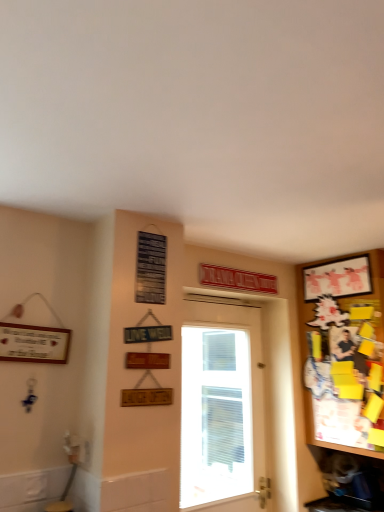
Question: Is white glossy door at center positioned beyond the bounds of matte white picture frame at upper right?

Choices:
 (A) yes
 (B) no

Answer: (A)

Question: Is white glossy door at center turned away from matte white picture frame at upper right?

Choices:
 (A) yes
 (B) no

Answer: (B)

Question: Could you tell me if white glossy door at center is turned towards matte white picture frame at upper right?

Choices:
 (A) no
 (B) yes

Answer: (B)

Question: From the image's perspective, is white glossy door at center over matte white picture frame at upper right?

Choices:
 (A) no
 (B) yes

Answer: (A)

Question: Is white glossy door at center positioned far away from matte white picture frame at upper right?

Choices:
 (A) no
 (B) yes

Answer: (B)

Question: Considering the relative positions of wooden bulletin board at right and white glossy door at center in the image provided, is wooden bulletin board at right to the left or to the right of white glossy door at center?

Choices:
 (A) right
 (B) left

Answer: (A)

Question: Is wooden bulletin board at right taller or shorter than white glossy door at center?

Choices:
 (A) tall
 (B) short

Answer: (B)

Question: From a real-world perspective, is wooden bulletin board at right physically located above or below white glossy door at center?

Choices:
 (A) below
 (B) above

Answer: (B)

Question: Considering their positions, is wooden bulletin board at right located in front of or behind white glossy door at center?

Choices:
 (A) front
 (B) behind

Answer: (A)

Question: Is matte white picture frame at upper right inside the boundaries of white glossy door at center, or outside?

Choices:
 (A) outside
 (B) inside

Answer: (A)

Question: Considering their positions, is matte white picture frame at upper right located in front of or behind white glossy door at center?

Choices:
 (A) front
 (B) behind

Answer: (B)

Question: Does point (360, 257) appear closer or farther from the camera than point (195, 351)?

Choices:
 (A) farther
 (B) closer

Answer: (B)

Question: From the image's perspective, is matte white picture frame at upper right positioned above or below white glossy door at center?

Choices:
 (A) above
 (B) below

Answer: (A)

Question: Considering the positions of point (307, 282) and point (336, 298), is point (307, 282) closer or farther from the camera than point (336, 298)?

Choices:
 (A) farther
 (B) closer

Answer: (A)

Question: From a real-world perspective, is matte white picture frame at upper right above or below wooden bulletin board at right?

Choices:
 (A) below
 (B) above

Answer: (B)